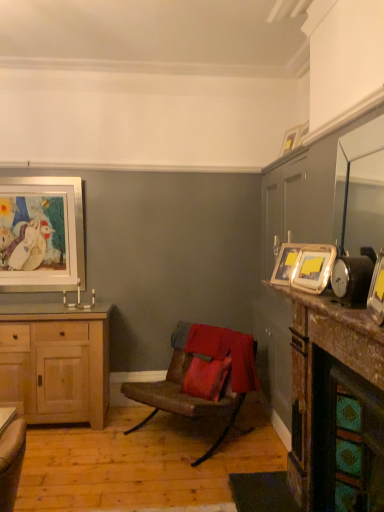
Where is `brown leather chair at center`? This screenshot has height=512, width=384. brown leather chair at center is located at coordinates [202, 376].

What do you see at coordinates (323, 385) in the screenshot? I see `marble fireplace at right, acting as the 1th counter top starting from the bottom` at bounding box center [323, 385].

You are a GUI agent. You are given a task and a screenshot of the screen. Output one action in this format:
    pyautogui.click(x=<x>, y=<y>)
    Task: Click on the wooden picture frame at upper right, which ranks as the fourth picture frame in front-to-back order
    This screenshot has height=512, width=384.
    Given the screenshot: What is the action you would take?
    pyautogui.click(x=302, y=134)

Describe the element at coordinates (377, 291) in the screenshot. I see `metallic gold picture frame at right, placed as the fifth picture frame when sorted from back to front` at that location.

I want to click on brown leather chair at center, so click(x=202, y=376).

Is matte gold picture frame at right, which appears as the fourth picture frame when viewed from the back, far away from matte white picture frame at upper left, which is counted as the fifth picture frame, starting from the front?

Yes.

In the image, is matte gold picture frame at right, the third picture frame positioned from the left, positioned in front of or behind matte white picture frame at upper left, the 1th picture frame when ordered from left to right?

matte gold picture frame at right, the third picture frame positioned from the left, is in front of matte white picture frame at upper left, the 1th picture frame when ordered from left to right.

Based on the photo, is matte gold picture frame at right, the second picture frame in the front-to-back sequence, looking in the opposite direction of matte white picture frame at upper left, which is counted as the fifth picture frame, starting from the front?

That's not correct — matte gold picture frame at right, the second picture frame in the front-to-back sequence, is not looking away from matte white picture frame at upper left, which is counted as the fifth picture frame, starting from the front.

Based on their positions, is matte gold picture frame at right, which appears as the fourth picture frame when viewed from the back, located to the left or right of matte white picture frame at upper left, the 1th picture frame when ordered from left to right?

From the image, it's evident that matte gold picture frame at right, which appears as the fourth picture frame when viewed from the back, is to the right of matte white picture frame at upper left, the 1th picture frame when ordered from left to right.

Does metallic gold picture frame at right, which appears as the fourth picture frame when viewed from the left, appear on the right side of wooden picture frame at upper right, which appears as the first picture frame when viewed from the right?

In fact, metallic gold picture frame at right, which appears as the fourth picture frame when viewed from the left, is to the left of wooden picture frame at upper right, which appears as the first picture frame when viewed from the right.

Can wooden picture frame at upper right, which ranks as the fifth picture frame in left-to-right order, be found inside metallic gold picture frame at right, acting as the 2th picture frame starting from the right?

No, wooden picture frame at upper right, which ranks as the fifth picture frame in left-to-right order, is not a part of metallic gold picture frame at right, acting as the 2th picture frame starting from the right.

Is metallic gold picture frame at right, positioned as the first picture frame in front-to-back order, aimed at wooden picture frame at upper right, which ranks as the fourth picture frame in front-to-back order?

No.

Is metallic gold picture frame at right, acting as the 2th picture frame starting from the right, taller or shorter than wooden picture frame at upper right, which ranks as the fourth picture frame in front-to-back order?

Clearly, metallic gold picture frame at right, acting as the 2th picture frame starting from the right, is taller compared to wooden picture frame at upper right, which ranks as the fourth picture frame in front-to-back order.

Is marble fireplace at right, marked as the 2th counter top in a top-to-bottom arrangement, bigger or smaller than light wood cabinet at left?

Considering their sizes, marble fireplace at right, marked as the 2th counter top in a top-to-bottom arrangement, takes up more space than light wood cabinet at left.

From a real-world perspective, between marble fireplace at right, marked as the 2th counter top in a top-to-bottom arrangement, and light wood cabinet at left, who is vertically higher?

marble fireplace at right, marked as the 2th counter top in a top-to-bottom arrangement, is physically above.

Is marble fireplace at right, marked as the 2th counter top in a top-to-bottom arrangement, not near light wood cabinet at left?

Yes, marble fireplace at right, marked as the 2th counter top in a top-to-bottom arrangement, is far from light wood cabinet at left.

From the image's perspective, who appears lower, brown leather chair at center or gold metallic picture frame at upper right, positioned as the 3th picture frame in back-to-front order?

brown leather chair at center is shown below in the image.

Considering the relative sizes of brown leather chair at center and gold metallic picture frame at upper right, placed as the fourth picture frame when sorted from right to left, in the image provided, is brown leather chair at center taller than gold metallic picture frame at upper right, placed as the fourth picture frame when sorted from right to left,?

Indeed, brown leather chair at center has a greater height compared to gold metallic picture frame at upper right, placed as the fourth picture frame when sorted from right to left.

Is brown leather chair at center located outside gold metallic picture frame at upper right, positioned as the 3th picture frame in back-to-front order?

brown leather chair at center lies outside gold metallic picture frame at upper right, positioned as the 3th picture frame in back-to-front order,'s area.

Is wooden picture frame at upper right, which appears as the first picture frame when viewed from the right, with brown leather chair at center?

wooden picture frame at upper right, which appears as the first picture frame when viewed from the right, is not next to brown leather chair at center, and they're not touching.

Which of these two, wooden picture frame at upper right, which ranks as the fourth picture frame in front-to-back order, or brown leather chair at center, is bigger?

With larger size is brown leather chair at center.

Can you confirm if wooden picture frame at upper right, which ranks as the fourth picture frame in front-to-back order, is taller than brown leather chair at center?

No.

Is marble fireplace at right, marked as the 2th counter top in a top-to-bottom arrangement, oriented towards matte white picture frame at upper left, the 1th picture frame when ordered from back to front?

No, marble fireplace at right, marked as the 2th counter top in a top-to-bottom arrangement, is not turned towards matte white picture frame at upper left, the 1th picture frame when ordered from back to front.

Is point (323, 428) closer or farther from the camera than point (18, 179)?

Point (323, 428) appears to be closer to the viewer than point (18, 179).

The image size is (384, 512). Find the location of `the 2nd counter top positioned below the matte white picture frame at upper left, which is the 5th picture frame from right to left (from the image's perspective)`. the 2nd counter top positioned below the matte white picture frame at upper left, which is the 5th picture frame from right to left (from the image's perspective) is located at coordinates (323, 385).

Does point (4, 249) come in front of point (174, 352)?

Yes, it is in front of point (174, 352).

Is matte white picture frame at upper left, the 1th picture frame when ordered from left to right, in contact with brown leather chair at center?

No, matte white picture frame at upper left, the 1th picture frame when ordered from left to right, is not in contact with brown leather chair at center.

Between matte white picture frame at upper left, the 1th picture frame when ordered from back to front, and brown leather chair at center, which one has larger size?

brown leather chair at center is bigger.

The image size is (384, 512). Identify the location of picture frame that is the 2nd one when counting leftward from the matte gold picture frame at right, the 3th picture frame positioned from the right. (41, 234).

There is a wooden picture frame at upper right, which ranks as the fourth picture frame in front-to-back order. Where is `the 4th picture frame below it (from the image's perspective)`? This screenshot has height=512, width=384. the 4th picture frame below it (from the image's perspective) is located at coordinates (377, 291).

Estimate the real-world distances between objects in this image. Which object is closer to matte white picture frame at upper left, the 1th picture frame when ordered from left to right, marble fireplace at right, acting as the 1th counter top starting from the bottom, or wooden picture frame at upper right, placed as the 2th picture frame when sorted from back to front?

wooden picture frame at upper right, placed as the 2th picture frame when sorted from back to front, is positioned closer to the anchor matte white picture frame at upper left, the 1th picture frame when ordered from left to right.

Estimate the real-world distances between objects in this image. Which object is further from matte gold picture frame at right, the third picture frame positioned from the left, brown leather chair at center or marble countertop at right, the first counter top when ordered from top to bottom?

The object further to matte gold picture frame at right, the third picture frame positioned from the left, is brown leather chair at center.

Considering their positions, is marble countertop at right, the first counter top when ordered from top to bottom, positioned closer to metallic gold picture frame at right, placed as the fifth picture frame when sorted from back to front, than gold metallic picture frame at upper right, positioned as the 3th picture frame in back-to-front order?

The object closer to metallic gold picture frame at right, placed as the fifth picture frame when sorted from back to front, is marble countertop at right, the first counter top when ordered from top to bottom.

From the image, which object appears to be farther from brown leather chair at center, matte white picture frame at upper left, the 1th picture frame when ordered from back to front, or metallic gold picture frame at right, positioned as the first picture frame in front-to-back order?

Among the two, metallic gold picture frame at right, positioned as the first picture frame in front-to-back order, is located further to brown leather chair at center.

When comparing their distances from marble fireplace at right, acting as the 1th counter top starting from the bottom, does matte white picture frame at upper left, the 1th picture frame when ordered from left to right, or gold metallic picture frame at upper right, which is the 2th picture frame in left-to-right order, seem closer?

Among the two, gold metallic picture frame at upper right, which is the 2th picture frame in left-to-right order, is located nearer to marble fireplace at right, acting as the 1th counter top starting from the bottom.

Based on their spatial positions, is brown leather chair at center or gold metallic picture frame at upper right, which is counted as the 3th picture frame, starting from the front, further from light wood cabinet at left?

gold metallic picture frame at upper right, which is counted as the 3th picture frame, starting from the front, lies further to light wood cabinet at left than the other object.

Which object lies nearer to the anchor point wooden picture frame at upper right, which ranks as the fourth picture frame in front-to-back order, brown leather chair at center or metallic gold picture frame at right, positioned as the first picture frame in front-to-back order?

metallic gold picture frame at right, positioned as the first picture frame in front-to-back order, lies closer to wooden picture frame at upper right, which ranks as the fourth picture frame in front-to-back order, than the other object.

Based on their spatial positions, is marble fireplace at right, marked as the 2th counter top in a top-to-bottom arrangement, or wooden picture frame at upper right, which ranks as the fifth picture frame in left-to-right order, further from matte gold picture frame at right, which appears as the fourth picture frame when viewed from the back?

wooden picture frame at upper right, which ranks as the fifth picture frame in left-to-right order, is positioned further to the anchor matte gold picture frame at right, which appears as the fourth picture frame when viewed from the back.

Where is `picture frame between marble countertop at right, the first counter top when ordered from top to bottom, and metallic silver alarm clock at right in the front-back direction`? picture frame between marble countertop at right, the first counter top when ordered from top to bottom, and metallic silver alarm clock at right in the front-back direction is located at coordinates (377, 291).

Find the location of a particular element. The height and width of the screenshot is (512, 384). alarm clock located between matte white picture frame at upper left, which is counted as the fifth picture frame, starting from the front, and wooden picture frame at upper right, which ranks as the fifth picture frame in left-to-right order, in the left-right direction is located at coordinates (352, 279).

Image resolution: width=384 pixels, height=512 pixels. In order to click on alarm clock positioned between metallic gold picture frame at right, positioned as the first picture frame in front-to-back order, and light wood cabinet at left from near to far in this screenshot , I will do `click(352, 279)`.

Find the location of a particular element. The height and width of the screenshot is (512, 384). chair between marble countertop at right, the first counter top when ordered from top to bottom, and wooden picture frame at upper right, which appears as the first picture frame when viewed from the right, along the z-axis is located at coordinates (202, 376).